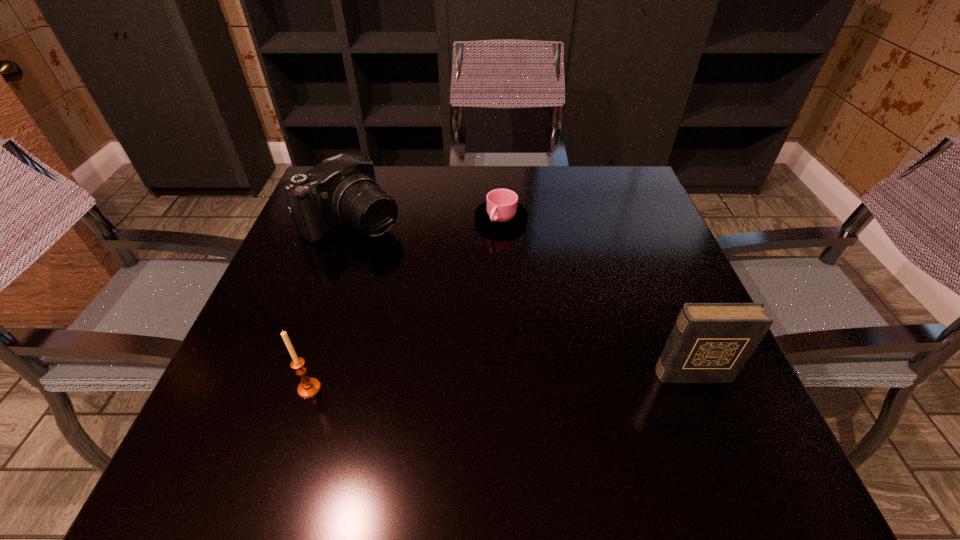
Locate an element on the screen. This screenshot has height=540, width=960. object at the far left corner is located at coordinates (342, 189).

Locate an element on the screen. object located at the near left corner is located at coordinates [309, 387].

Locate an element on the screen. The width and height of the screenshot is (960, 540). object situated at the near right corner is located at coordinates (710, 342).

Identify the location of free location at the far edge. (449, 188).

I want to click on free region at the near edge of the desktop, so click(x=396, y=399).

At what (x,y) coordinates should I click in order to perform the action: click on vacant space at the left edge of the desktop. Please return your answer as a coordinate pair (x, y). This screenshot has width=960, height=540. Looking at the image, I should click on (306, 327).

I want to click on vacant area at the right edge, so click(621, 244).

Locate an element on the screen. Image resolution: width=960 pixels, height=540 pixels. vacant space at the near right corner of the desktop is located at coordinates (714, 396).

The image size is (960, 540). Find the location of `vacant space that's between the camera and the candle_holder`. vacant space that's between the camera and the candle_holder is located at coordinates (331, 305).

You are a GUI agent. You are given a task and a screenshot of the screen. Output one action in this format:
    pyautogui.click(x=<x>, y=<y>)
    Task: Click on the free space between the candle_holder and the cup
    The image size is (960, 540).
    Given the screenshot: What is the action you would take?
    pyautogui.click(x=405, y=304)